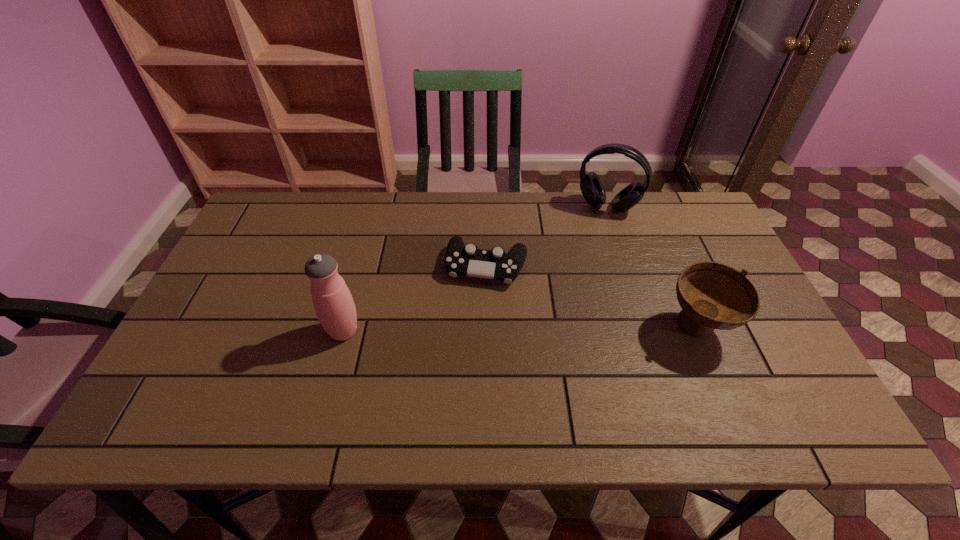
Point out which object is positioned as the third nearest to the second shortest object. Please provide its 2D coordinates. Your answer should be formatted as a tuple, i.e. [(x, y)], where the tuple contains the x and y coordinates of a point satisfying the conditions above.

[(334, 306)]

Where is `object that is the nearest to the third tallest object`? The height and width of the screenshot is (540, 960). object that is the nearest to the third tallest object is located at coordinates (468, 260).

Locate an element on the screen. The height and width of the screenshot is (540, 960). vacant space that satisfies the following two spatial constraints: 1. on the front side of the second object from left to right; 2. on the right side of the second shortest object is located at coordinates (488, 328).

In order to click on free space that satisfies the following two spatial constraints: 1. on the back side of the soup bowl; 2. on the left side of the thermos bottle in this screenshot , I will do `click(345, 328)`.

The height and width of the screenshot is (540, 960). I want to click on free space that satisfies the following two spatial constraints: 1. on the front side of the farthest object; 2. on the right side of the soup bowl, so click(647, 328).

You are a GUI agent. You are given a task and a screenshot of the screen. Output one action in this format:
    pyautogui.click(x=<x>, y=<y>)
    Task: Click on the vacant region that satisfies the following two spatial constraints: 1. on the front side of the farthest object; 2. on the left side of the soup bowl
    The width and height of the screenshot is (960, 540).
    Given the screenshot: What is the action you would take?
    pyautogui.click(x=647, y=328)